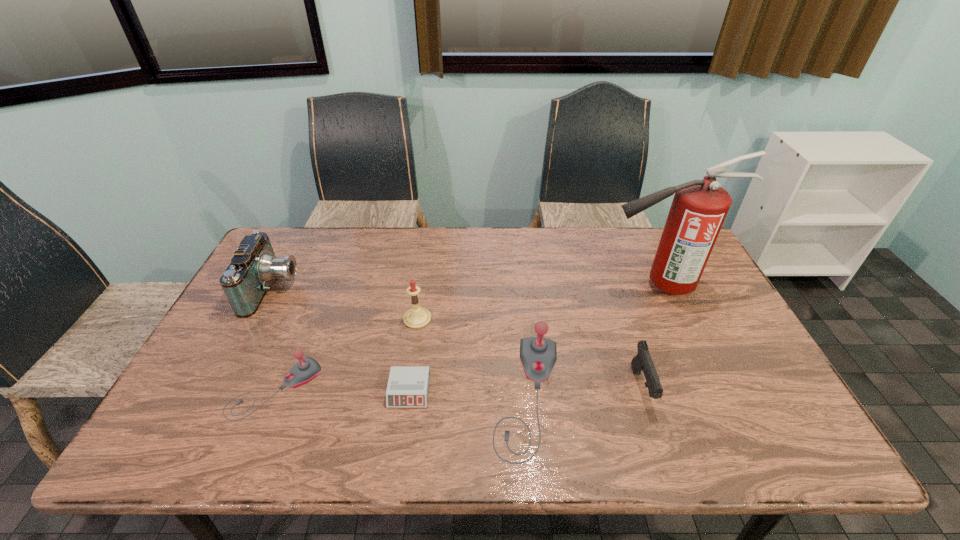
The height and width of the screenshot is (540, 960). In order to click on empty space between the second shortest object and the tallest object in this screenshot , I will do `click(468, 337)`.

Where is `free point between the shortest object and the candle`? Image resolution: width=960 pixels, height=540 pixels. free point between the shortest object and the candle is located at coordinates (413, 355).

Where is `object that is the third nearest to the alarm clock`? This screenshot has height=540, width=960. object that is the third nearest to the alarm clock is located at coordinates (304, 371).

In order to click on the fourth closest object relative to the pistol in this screenshot , I will do `click(417, 317)`.

This screenshot has width=960, height=540. I want to click on free space that satisfies the following two spatial constraints: 1. on the back side of the candle; 2. on the front-facing side of the camcorder, so click(421, 289).

I want to click on vacant area in the image that satisfies the following two spatial constraints: 1. on the front-facing side of the right joystick; 2. on the left side of the camcorder, so click(x=217, y=396).

At what (x,y) coordinates should I click in order to perform the action: click on free space that satisfies the following two spatial constraints: 1. at the nozzle of the tallest object; 2. at the barrel of the pistol. Please return your answer as a coordinate pair (x, y). The image size is (960, 540). Looking at the image, I should click on (706, 388).

What are the coordinates of `blank space that satisfies the following two spatial constraints: 1. on the back side of the left joystick; 2. on the front-facing side of the camcorder` in the screenshot? It's located at tap(317, 289).

This screenshot has height=540, width=960. What are the coordinates of `vacant area in the image that satisfies the following two spatial constraints: 1. on the front-facing side of the second shortest object; 2. on the right side of the camcorder` in the screenshot? It's located at (221, 389).

This screenshot has width=960, height=540. Identify the location of free space that satisfies the following two spatial constraints: 1. on the back side of the shorter joystick; 2. on the front-facing side of the camcorder. (317, 289).